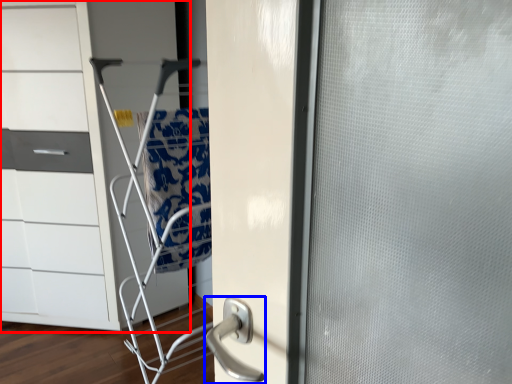
Question: Which point is further to the camera, chest of drawers (highlighted by a red box) or door handle (highlighted by a blue box)?

Choices:
 (A) chest of drawers
 (B) door handle

Answer: (B)